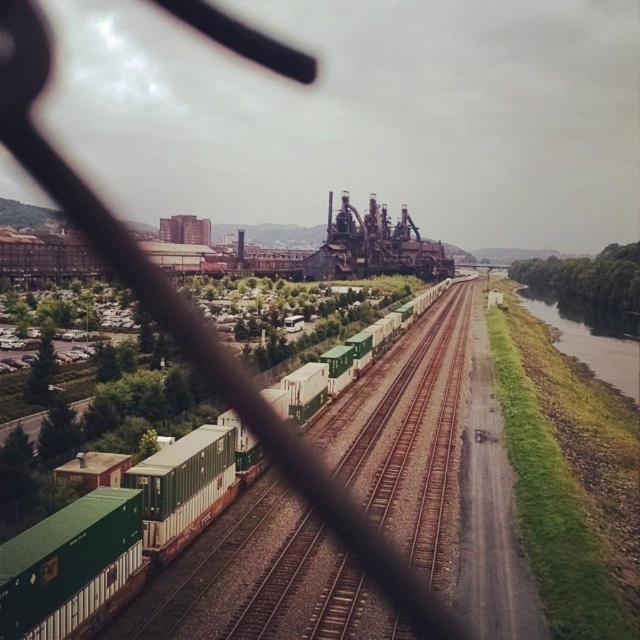
I want to click on green grassy river at right, so click(589, 337).

Does green grassy river at right have a greater width compared to green matte container at left?

Yes.

Which is behind, point (582, 355) or point (394, 394)?

Point (582, 355)

Locate an element on the screen. The height and width of the screenshot is (640, 640). green grassy river at right is located at coordinates (589, 337).